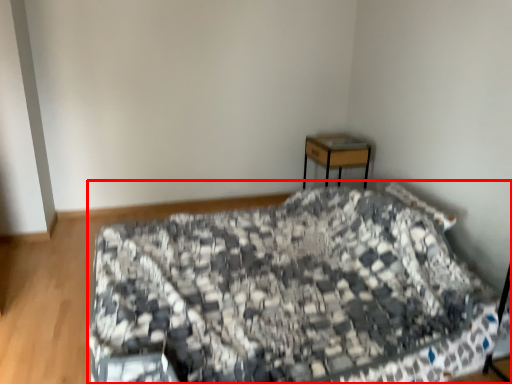
Question: From the image's perspective, where is bed (annotated by the red box) located relative to desk?

Choices:
 (A) below
 (B) above

Answer: (A)